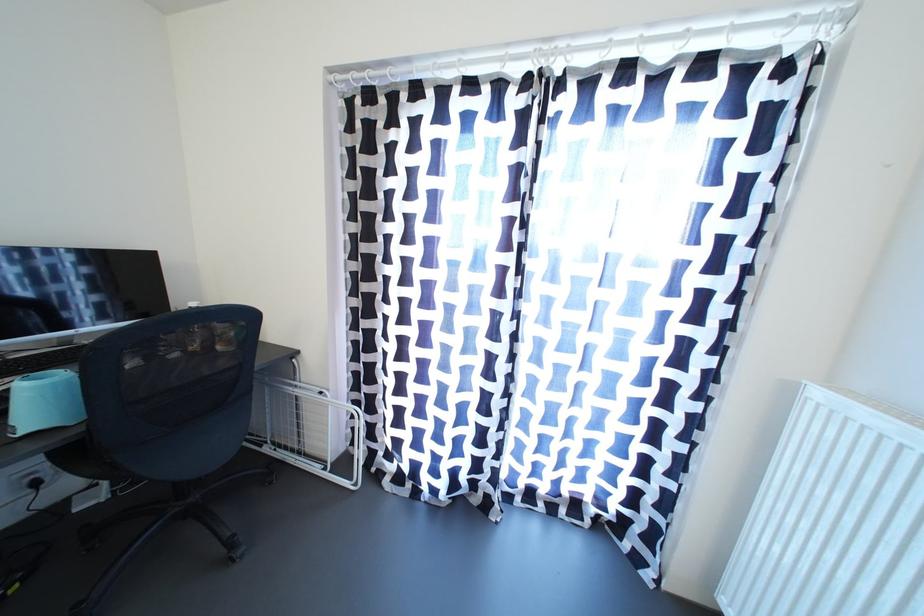
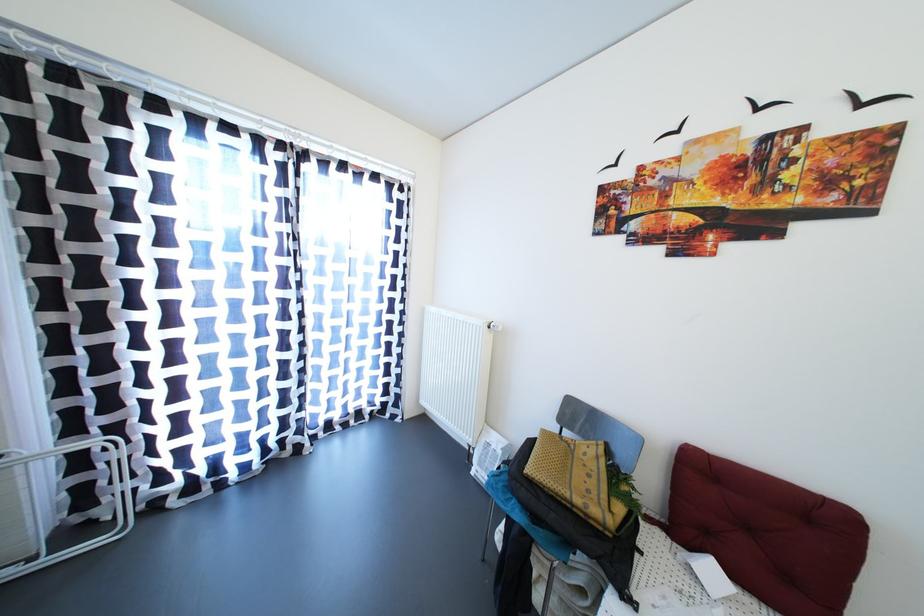
In the second image, find the point that corresponds to point 332,474 in the first image.

(39, 564)